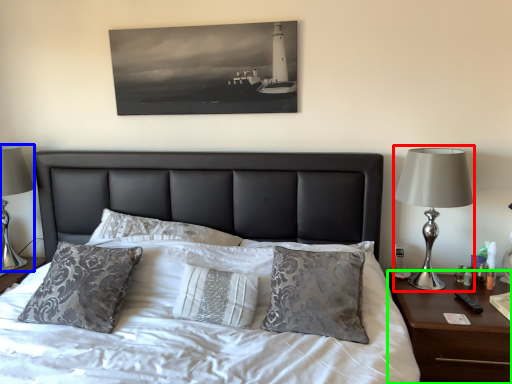
Question: Considering the real-world distances, which object is closest to bedside lamp (highlighted by a red box)? table lamp (highlighted by a blue box) or nightstand (highlighted by a green box).

Choices:
 (A) table lamp
 (B) nightstand

Answer: (B)